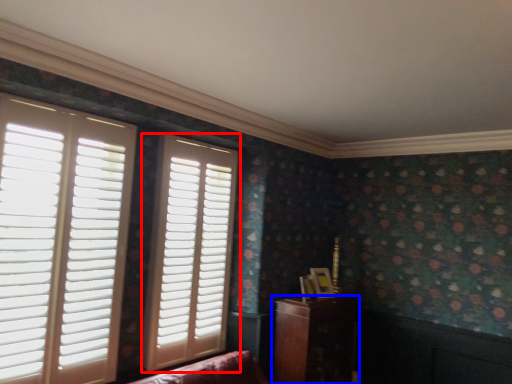
Question: Among these objects, which one is nearest to the camera, window (highlighted by a red box) or furniture (highlighted by a blue box)?

Choices:
 (A) window
 (B) furniture

Answer: (A)